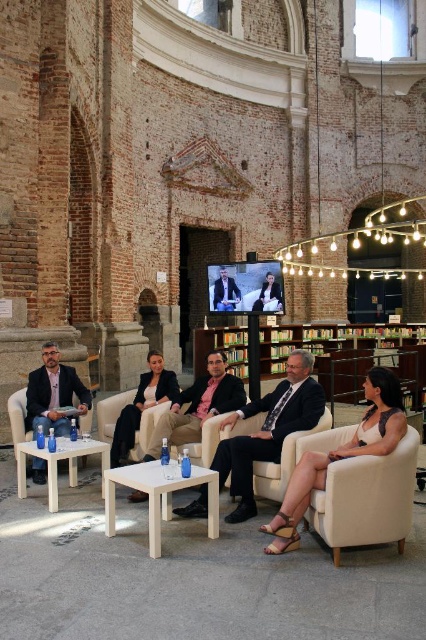
Question: Which point is closer to the camera?

Choices:
 (A) (354, 355)
 (B) (288, 449)
 (C) (287, 525)

Answer: (C)

Question: Is light beige fabric armchair at lower right bigger than matte black suit at left?

Choices:
 (A) yes
 (B) no

Answer: (B)

Question: Considering the real-world distances, which object is closest to the matte beige chair at center?

Choices:
 (A) light beige fabric armchair at lower right
 (B) matte black suit at left

Answer: (A)

Question: Which point is closer to the camera taking this photo?

Choices:
 (A) click(184, 515)
 (B) click(25, 484)
 (C) click(143, 413)
 (D) click(54, 385)

Answer: (A)

Question: Is wooden bookshelf at center positioned at the back of matte black suit at left?

Choices:
 (A) yes
 (B) no

Answer: (A)

Question: Is dark suit at center thinner than light wood square table at center?

Choices:
 (A) no
 (B) yes

Answer: (A)